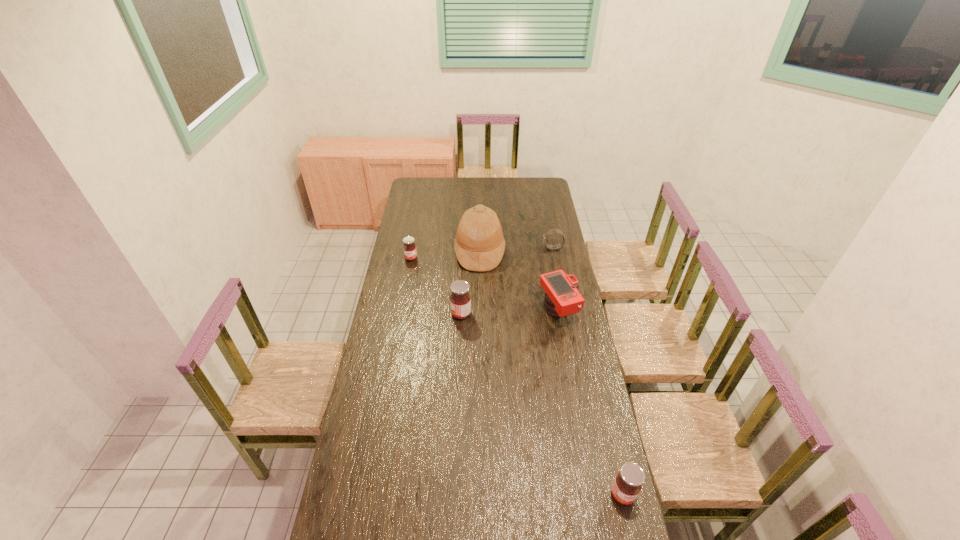
Identify the location of blank region between the shortest jam and the hat. This screenshot has width=960, height=540. (445, 255).

The width and height of the screenshot is (960, 540). What are the coordinates of `free space between the hat and the second jam from left to right` in the screenshot? It's located at (470, 283).

Find the location of a particular element. Image resolution: width=960 pixels, height=540 pixels. free spot between the hat and the second nearest jam is located at coordinates (470, 283).

You are a GUI agent. You are given a task and a screenshot of the screen. Output one action in this format:
    pyautogui.click(x=<x>, y=<y>)
    Task: Click on the vacant space that is in between the camera and the second jam from right to left
    The width and height of the screenshot is (960, 540).
    Given the screenshot: What is the action you would take?
    pyautogui.click(x=510, y=313)

I want to click on empty space that is in between the watch and the hat, so click(516, 250).

This screenshot has width=960, height=540. In order to click on free spot between the tallest object and the nearest object in this screenshot , I will do `click(551, 373)`.

I want to click on vacant space that's between the camera and the shortest jam, so click(485, 285).

I want to click on free area in between the camera and the leftmost object, so click(x=485, y=285).

Image resolution: width=960 pixels, height=540 pixels. I want to click on free space between the farthest jam and the camera, so click(x=485, y=285).

This screenshot has width=960, height=540. I want to click on object that is the closest to the second tallest jam, so click(562, 299).